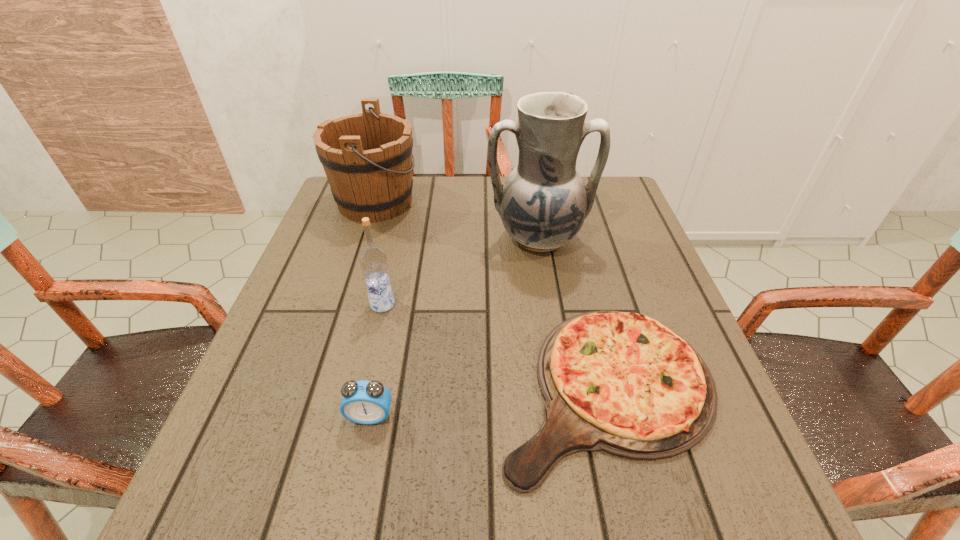
This screenshot has width=960, height=540. Identify the location of pitcher located in the far edge section of the desktop. (544, 202).

Where is `wine bucket at the far edge`? The image size is (960, 540). wine bucket at the far edge is located at coordinates (367, 158).

This screenshot has width=960, height=540. In order to click on object that is at the near edge in this screenshot , I will do `click(623, 383)`.

Image resolution: width=960 pixels, height=540 pixels. What are the coordinates of `object present at the left edge` in the screenshot? It's located at (367, 158).

I want to click on pitcher present at the right edge, so click(x=544, y=202).

The width and height of the screenshot is (960, 540). Identify the location of pizza present at the right edge. (623, 383).

At what (x,y) coordinates should I click in order to perform the action: click on object situated at the far left corner. Please return your answer as a coordinate pair (x, y). The height and width of the screenshot is (540, 960). Looking at the image, I should click on (367, 158).

The height and width of the screenshot is (540, 960). What are the coordinates of `object positioned at the far right corner` in the screenshot? It's located at [x=544, y=202].

You are a GUI agent. You are given a task and a screenshot of the screen. Output one action in this format:
    pyautogui.click(x=<x>, y=<y>)
    Task: Click on the object situated at the near right corner
    This screenshot has width=960, height=540.
    Given the screenshot: What is the action you would take?
    pyautogui.click(x=623, y=383)

Find the location of a particular element. vacant region at the far edge of the desktop is located at coordinates (476, 213).